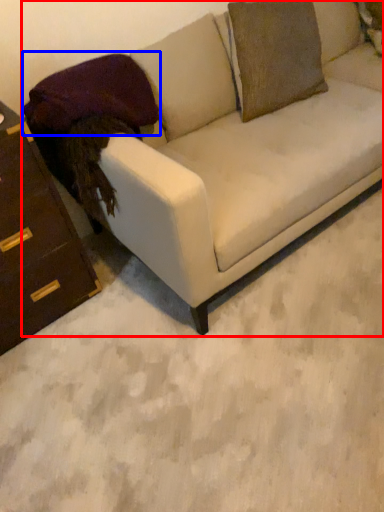
Question: Which point is further to the camera, studio couch (highlighted by a red box) or pillow (highlighted by a blue box)?

Choices:
 (A) studio couch
 (B) pillow

Answer: (B)